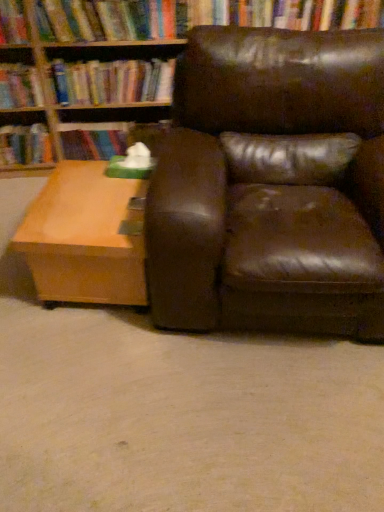
Question: From the image's perspective, would you say light brown wood coffee table at lower left is shown under hardcover book at upper center, which is the first book in right-to-left order?

Choices:
 (A) no
 (B) yes

Answer: (B)

Question: Considering the relative positions of light brown wood coffee table at lower left and hardcover book at upper center, which is the first book in right-to-left order, in the image provided, is light brown wood coffee table at lower left to the left of hardcover book at upper center, which is the first book in right-to-left order, from the viewer's perspective?

Choices:
 (A) yes
 (B) no

Answer: (B)

Question: Is light brown wood coffee table at lower left located outside hardcover book at upper center, which ranks as the 4th book in left-to-right order?

Choices:
 (A) no
 (B) yes

Answer: (B)

Question: Does light brown wood coffee table at lower left have a larger size compared to hardcover book at upper center, which ranks as the 4th book in left-to-right order?

Choices:
 (A) yes
 (B) no

Answer: (A)

Question: Is light brown wood coffee table at lower left facing away from hardcover book at upper center, which is the first book in right-to-left order?

Choices:
 (A) no
 (B) yes

Answer: (B)

Question: Does light brown wood coffee table at lower left have a greater height compared to hardcover book at upper center, which is the first book in right-to-left order?

Choices:
 (A) no
 (B) yes

Answer: (B)

Question: From the image's perspective, would you say hardcover book at center, the 3th book when ordered from left to right, is positioned over light brown wood coffee table at lower left?

Choices:
 (A) no
 (B) yes

Answer: (B)

Question: Considering the relative sizes of hardcover book at center, which appears as the 2th book when viewed from the right, and light brown wood coffee table at lower left in the image provided, is hardcover book at center, which appears as the 2th book when viewed from the right, thinner than light brown wood coffee table at lower left?

Choices:
 (A) no
 (B) yes

Answer: (B)

Question: Is hardcover book at center, the 3th book when ordered from left to right, facing towards light brown wood coffee table at lower left?

Choices:
 (A) yes
 (B) no

Answer: (A)

Question: Considering the relative sizes of hardcover book at center, the 3th book when ordered from left to right, and light brown wood coffee table at lower left in the image provided, is hardcover book at center, the 3th book when ordered from left to right, shorter than light brown wood coffee table at lower left?

Choices:
 (A) yes
 (B) no

Answer: (A)

Question: Does hardcover book at center, the 3th book when ordered from left to right, come in front of light brown wood coffee table at lower left?

Choices:
 (A) no
 (B) yes

Answer: (A)

Question: Is hardcover book at center, the 3th book when ordered from left to right, looking in the opposite direction of light brown wood coffee table at lower left?

Choices:
 (A) no
 (B) yes

Answer: (A)

Question: Can we say hardcover book at center, which appears as the 2th book when viewed from the right, lies outside hardcover book at left, which ranks as the 1th book in left-to-right order?

Choices:
 (A) no
 (B) yes

Answer: (B)